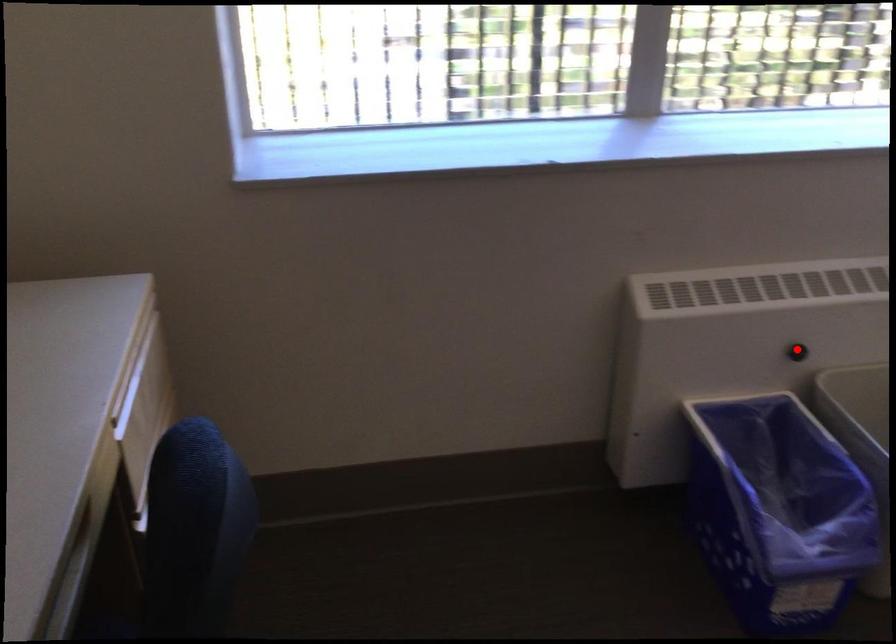
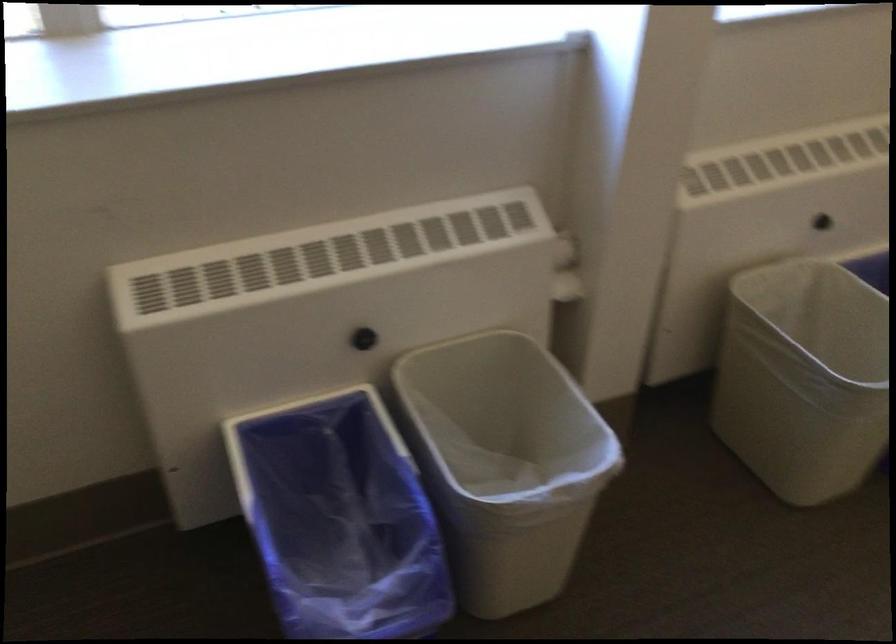
Find the pixel in the second image that matches the highlighted location in the first image.

(364, 339)